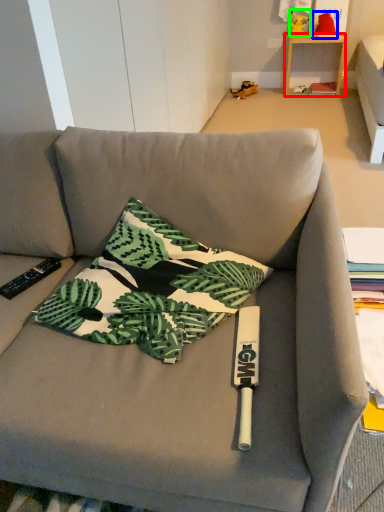
Question: Which object is positioned closest to table (highlighted by a red box)? Select from toy (highlighted by a blue box) and toy (highlighted by a green box).

Choices:
 (A) toy
 (B) toy

Answer: (A)